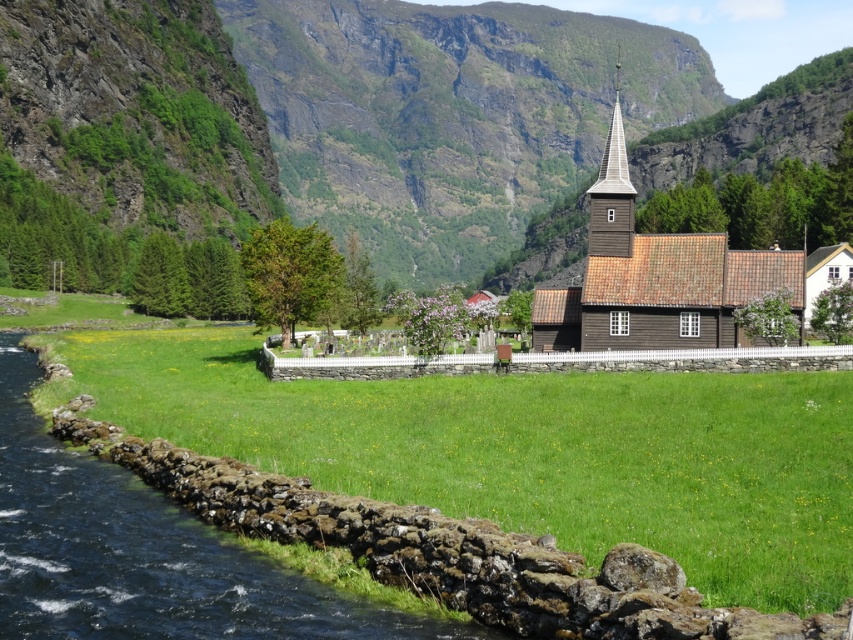
You are a drone operator planning to fly a drone from the brown wooden church at center to the brown wooden spire at upper center. The drone has a maximum flight range of 10 meters. Can the drone safely reach the spire from the church without running out of battery?

The distance between the brown wooden church at center and the brown wooden spire at upper center is 8.60 meters, which is within the drone operator drone has a maximum flight range of 10 meters. The drone can safely reach the spire from the church without running out of battery.

You are a landscape architect designing a walking path through the scene. You need to decide where to place a bench so that it is closer to the wider area of greenery. Which area should you choose between the green grassy field at lower center and the green grass at center?

The green grassy field at lower center has a greater width than the green grass at center, so placing the bench closer to the green grassy field at lower center would be better as it offers a wider green area.